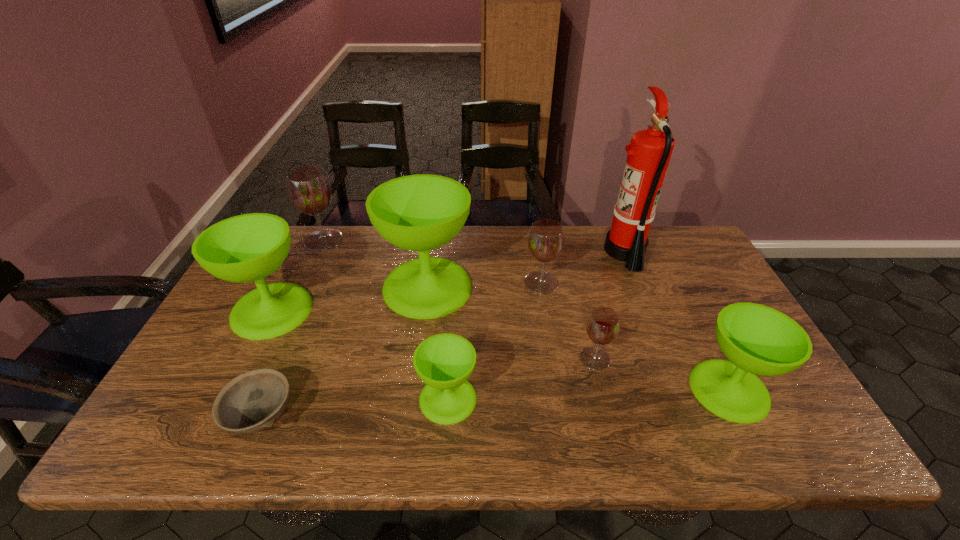
Find the location of a particular element. Image resolution: width=960 pixels, height=540 pixels. fire extinguisher is located at coordinates (649, 152).

The width and height of the screenshot is (960, 540). Find the location of `red fire extinguisher`. red fire extinguisher is located at coordinates (649, 152).

The width and height of the screenshot is (960, 540). I want to click on the eighth shortest object, so click(422, 212).

Where is `the biggest green wineglass`? The image size is (960, 540). the biggest green wineglass is located at coordinates (422, 212).

Image resolution: width=960 pixels, height=540 pixels. Identify the location of the farthest red wineglass. (308, 187).

Where is `the farthest wineglass`? The width and height of the screenshot is (960, 540). the farthest wineglass is located at coordinates (308, 187).

Where is `the leftmost green wineglass`? This screenshot has height=540, width=960. the leftmost green wineglass is located at coordinates (244, 248).

Image resolution: width=960 pixels, height=540 pixels. Identify the location of the rightmost wineglass. (756, 339).

Locate an element on the screen. The height and width of the screenshot is (540, 960). the third biggest green wineglass is located at coordinates (756, 339).

The width and height of the screenshot is (960, 540). I want to click on the second red wineglass from right to left, so click(546, 239).